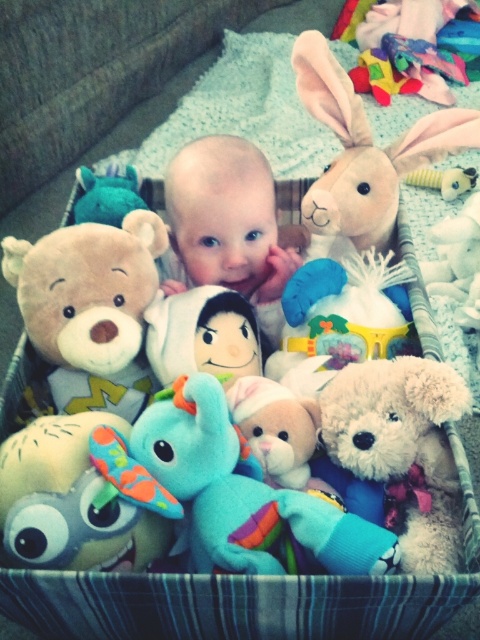
Question: Does soft plush elephant at center appear over fluffy white teddy bear at center?

Choices:
 (A) no
 (B) yes

Answer: (A)

Question: Which object is positioned farthest from the multicolored fabric toy at upper right?

Choices:
 (A) fluffy white teddy bear at center
 (B) smooth skin baby at center
 (C) soft plush toys at center

Answer: (A)

Question: Which point is closer to the camera?

Choices:
 (A) (340, 400)
 (B) (446, 68)

Answer: (A)

Question: Which of the following is the farthest from the observer?

Choices:
 (A) (379, 100)
 (B) (117, 314)
 (C) (407, 433)

Answer: (A)

Question: Is soft plush bear at left smaller than fluffy white teddy bear at center?

Choices:
 (A) yes
 (B) no

Answer: (B)

Question: Does soft plush bear at left appear on the right side of multicolored fabric toy at upper right?

Choices:
 (A) no
 (B) yes

Answer: (A)